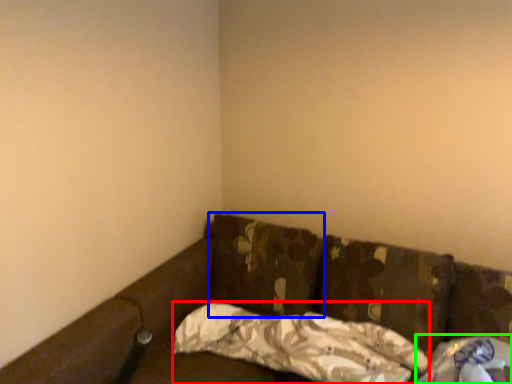
Question: Based on their relative distances, which object is nearer to pillow (highlighted by a red box)? Choose from pillow (highlighted by a blue box) and material (highlighted by a green box).

Choices:
 (A) pillow
 (B) material

Answer: (A)